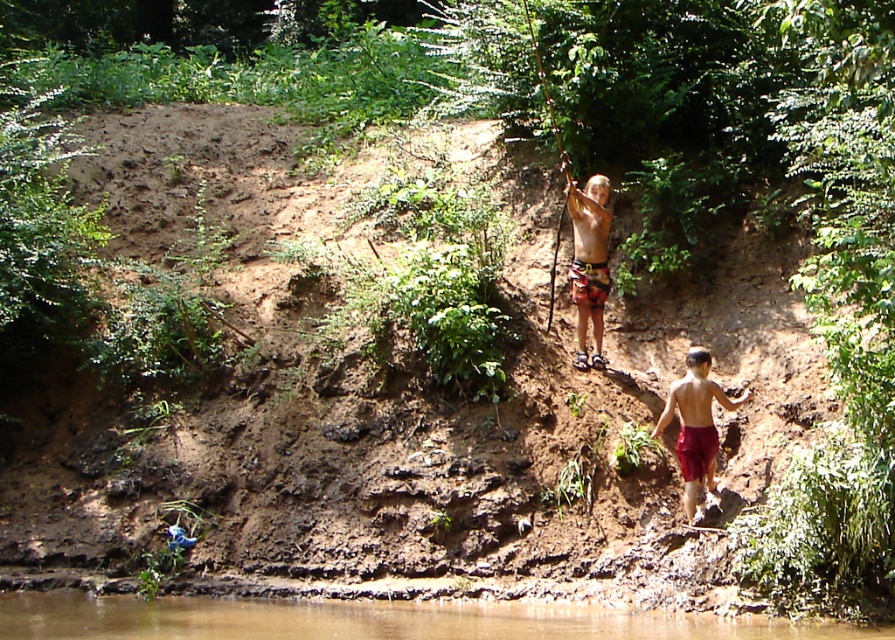
You are planning to cross the brown muddy water at lower center and need to know if the multicolored shorts at center can be used as a reference for depth. Can you determine which object is smaller in size?

The brown muddy water at lower center is smaller than the multicolored shorts at center, so the shorts are larger and might not be a reliable reference for depth since they are bigger.

You are a hiker trying to cross the brown muddy water at lower center to reach the multicolored shorts at center. Based on the terrain described, is the water crossing feasible? Consider the width of the water and the stability of the ground around it.

The brown muddy water at lower center might be wider than multicolored shorts at center, making the crossing potentially challenging due to the uncertain width and the unstable, muddy terrain around it. Proceed with caution.